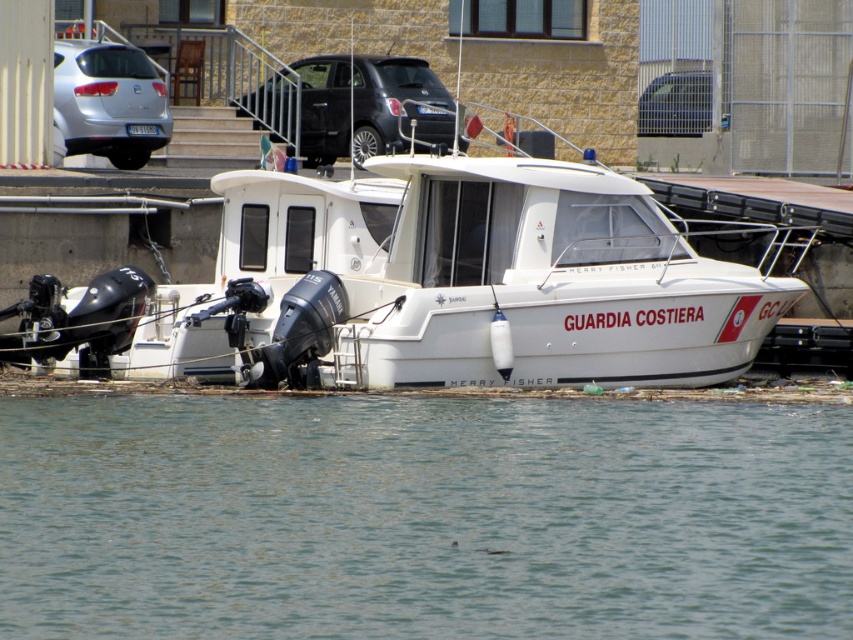
You are a driver approaching the intersection and see a black matte car at upper center and a metallic silver car at upper center. Which car is blocking your view of the other?

The black matte car at upper center is blocking your view of the metallic silver car at upper center because it is positioned in front of it.

From the picture: You are a driver approaching the intersection and see a black matte car at upper center and a metallic silver car at upper center. Which car is closer to you?

The black matte car at upper center is closer to you because it is located below the metallic silver car at upper center, indicating it is in front in the visual perspective.